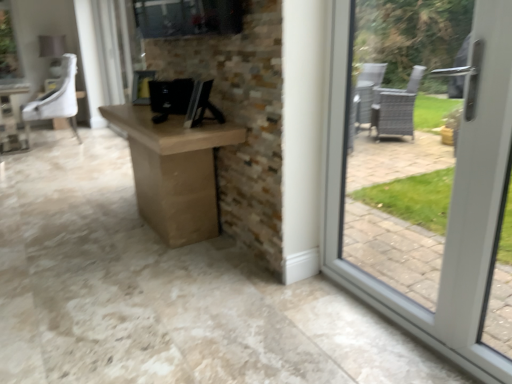
The image size is (512, 384). Find the location of `free space in front of white leather chair at upper left`. free space in front of white leather chair at upper left is located at coordinates (38, 155).